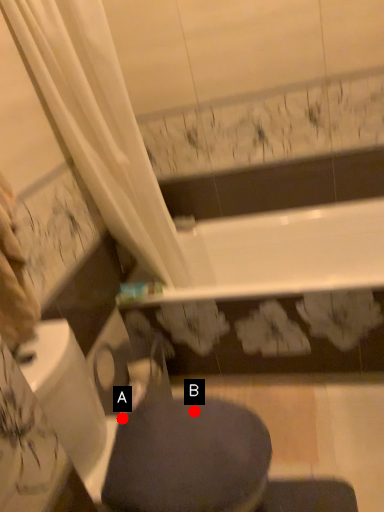
Question: Two points are circled on the image, labeled by A and B beside each circle. Which of the following is the farthest from the observer?

Choices:
 (A) A is further
 (B) B is further

Answer: (A)